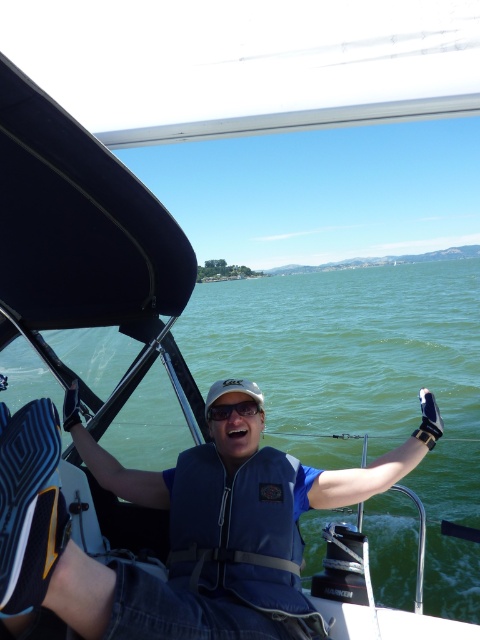
Question: Which of the following is the farthest from the observer?

Choices:
 (A) (299, 593)
 (B) (265, 620)
 (C) (238, 401)

Answer: (C)

Question: Is blue fabric life vest at center thinner than matte black goggles at center?

Choices:
 (A) no
 (B) yes

Answer: (A)

Question: Is the position of blue fabric life jacket at center more distant than that of matte black goggles at center?

Choices:
 (A) no
 (B) yes

Answer: (A)

Question: Which object is positioned closest to the blue fabric life vest at center?

Choices:
 (A) matte black goggles at center
 (B) blue fabric life jacket at center

Answer: (B)

Question: Based on their relative distances, which object is farther from the blue fabric life jacket at center?

Choices:
 (A) matte black goggles at center
 (B) blue fabric life vest at center

Answer: (A)

Question: Does blue fabric life jacket at center have a greater width compared to matte black goggles at center?

Choices:
 (A) no
 (B) yes

Answer: (B)